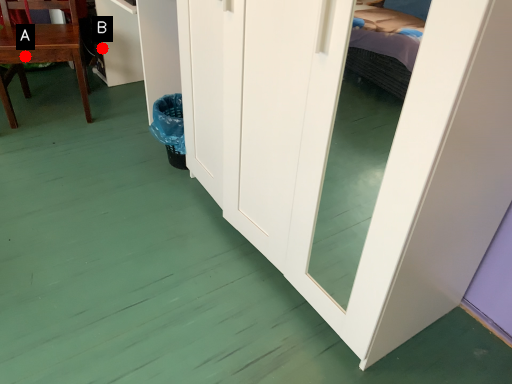
Question: Two points are circled on the image, labeled by A and B beside each circle. Among these points, which one is nearest to the camera?

Choices:
 (A) A is closer
 (B) B is closer

Answer: (A)